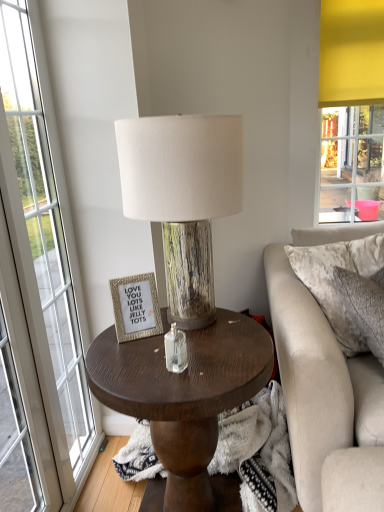
Where is `free space in front of gold textured picture frame at upper center`? free space in front of gold textured picture frame at upper center is located at coordinates (127, 359).